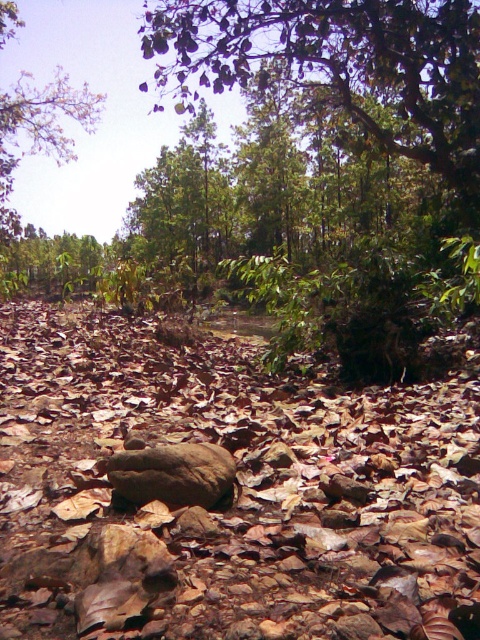
Question: Can you confirm if green leafy tree at upper left is smaller than brown rough boulder at center?

Choices:
 (A) no
 (B) yes

Answer: (A)

Question: Observing the image, what is the correct spatial positioning of green leafy tree at upper left in reference to brown rough boulder at center?

Choices:
 (A) left
 (B) right

Answer: (A)

Question: Which point is farther to the camera?

Choices:
 (A) (64, 152)
 (B) (216, 499)

Answer: (A)

Question: Based on their relative distances, which object is nearer to the green leafy tree at upper left?

Choices:
 (A) brown rough boulder at center
 (B) brown rough rock at center

Answer: (A)

Question: Among these points, which one is farthest from the camera?

Choices:
 (A) (183, 461)
 (B) (409, 586)

Answer: (A)

Question: Can you confirm if green leafy tree at upper left is thinner than brown rough boulder at center?

Choices:
 (A) yes
 (B) no

Answer: (B)